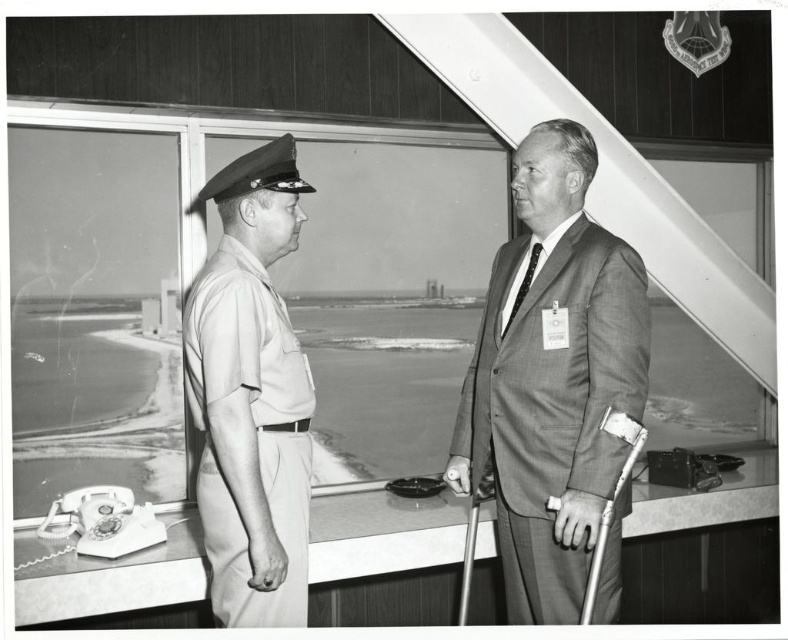
You are an observer in the room. You see the gray suit at center and the khaki uniform at left. Which object is located to the right of the other?

The gray suit at center is positioned on the right side of khaki uniform at left.

You are organizing a photo exhibition and want to display the image where the khaki uniform at left and gray suit at center are visible. To ensure visitors can see both outfits clearly, which one should be placed closer to the front of the display?

The khaki uniform at left is behind the gray suit at center, so to ensure both are visible, the gray suit at center should be placed closer to the front so that the khaki uniform at left isn not obscured.